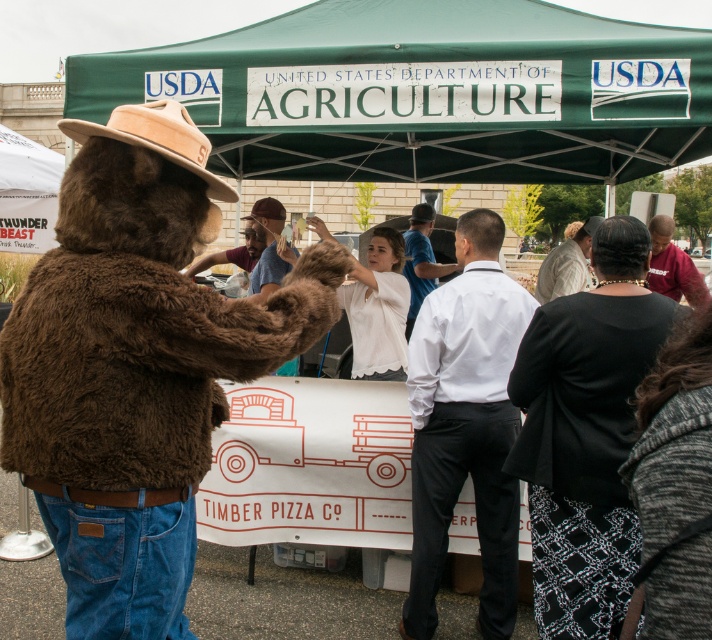
You are a photographer at the USDA event. You want to take a photo of the white smooth shirt at center and the brown fur hat at center. Can you see both objects in the same frame without moving the camera?

The white smooth shirt at center is positioned under the brown fur hat at center, so yes, both objects can be captured in the same frame without moving the camera since they are vertically aligned.

You are standing at the point labeled with coordinates (258, 225) at a USDA event. If you want to take a photo of the entire USDA tent area, would you need to move closer or farther away from the point to ensure the entire tent fits in your camera frame?

The point labeled with coordinates (258, 225) is 21.71 feet away from the camera. To capture the entire USDA tent area in the photo, you would need to move farther away from the point to ensure the entire tent fits in the camera frame.

You are a photographer at the USDA event and want to capture both the white smooth shirt at center and the brown fur hat at center in a single frame. Which object should you focus on first to ensure both are in the frame?

You should focus on the white smooth shirt at center first because it is larger in size than the brown fur hat at center, ensuring it fits within the frame while the smaller hat remains visible.